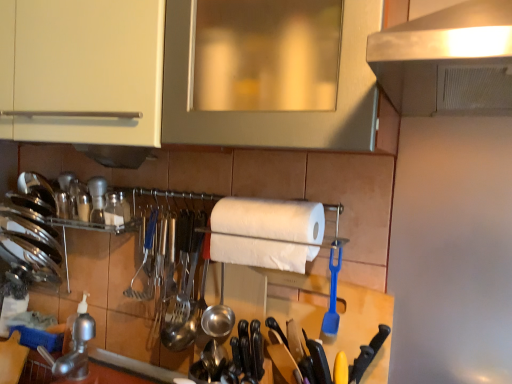
Question: From the image's perspective, is polished metal knife set at center, the third silverware viewed from the back, on top of wooden spatula at center?

Choices:
 (A) yes
 (B) no

Answer: (A)

Question: Is polished metal knife set at center, the third silverware viewed from the back, taller than wooden spatula at center?

Choices:
 (A) no
 (B) yes

Answer: (A)

Question: Is polished metal knife set at center, arranged as the 2th silverware when viewed from the right, positioned far away from wooden spatula at center?

Choices:
 (A) no
 (B) yes

Answer: (A)

Question: Is polished metal knife set at center, the 2th silverware when ordered from left to right, wider than wooden spatula at center?

Choices:
 (A) no
 (B) yes

Answer: (A)

Question: Is polished metal knife set at center, the 2th silverware when ordered from left to right, looking in the opposite direction of wooden spatula at center?

Choices:
 (A) yes
 (B) no

Answer: (B)

Question: From a real-world perspective, is polished metal knife set at center, acting as the 1th silverware starting from the front, on top of wooden spatula at center?

Choices:
 (A) no
 (B) yes

Answer: (B)

Question: Is shiny metallic utensils at center, positioned as the 1th silverware in left-to-right order, surrounding blue plastic spatula at center, acting as the second silverware starting from the back?

Choices:
 (A) yes
 (B) no

Answer: (B)

Question: Does shiny metallic utensils at center, acting as the third silverware starting from the right, have a greater width compared to blue plastic spatula at center, which appears as the first silverware when viewed from the right?

Choices:
 (A) no
 (B) yes

Answer: (B)

Question: Is shiny metallic utensils at center, acting as the third silverware starting from the right, positioned beyond the bounds of blue plastic spatula at center, the third silverware in the left-to-right sequence?

Choices:
 (A) no
 (B) yes

Answer: (B)

Question: Is shiny metallic utensils at center, which is the first silverware in back-to-front order, not near blue plastic spatula at center, which appears as the first silverware when viewed from the right?

Choices:
 (A) yes
 (B) no

Answer: (B)

Question: Does shiny metallic utensils at center, acting as the third silverware starting from the right, lie in front of blue plastic spatula at center, which appears as the first silverware when viewed from the right?

Choices:
 (A) no
 (B) yes

Answer: (A)

Question: From a real-world perspective, is shiny metallic utensils at center, which is the first silverware in back-to-front order, physically below blue plastic spatula at center, the third silverware in the left-to-right sequence?

Choices:
 (A) no
 (B) yes

Answer: (B)

Question: Is shiny metallic utensils at center, which is the first silverware in back-to-front order, next to wooden spatula at center and touching it?

Choices:
 (A) no
 (B) yes

Answer: (A)